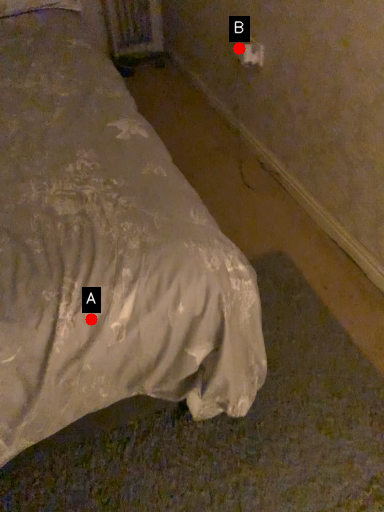
Question: Two points are circled on the image, labeled by A and B beside each circle. Among these points, which one is farthest from the camera?

Choices:
 (A) A is further
 (B) B is further

Answer: (B)